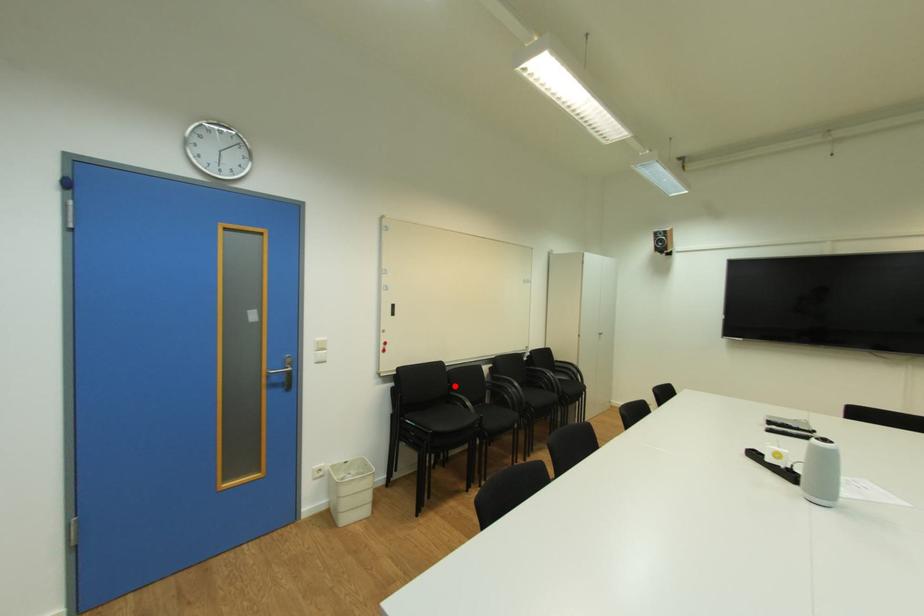
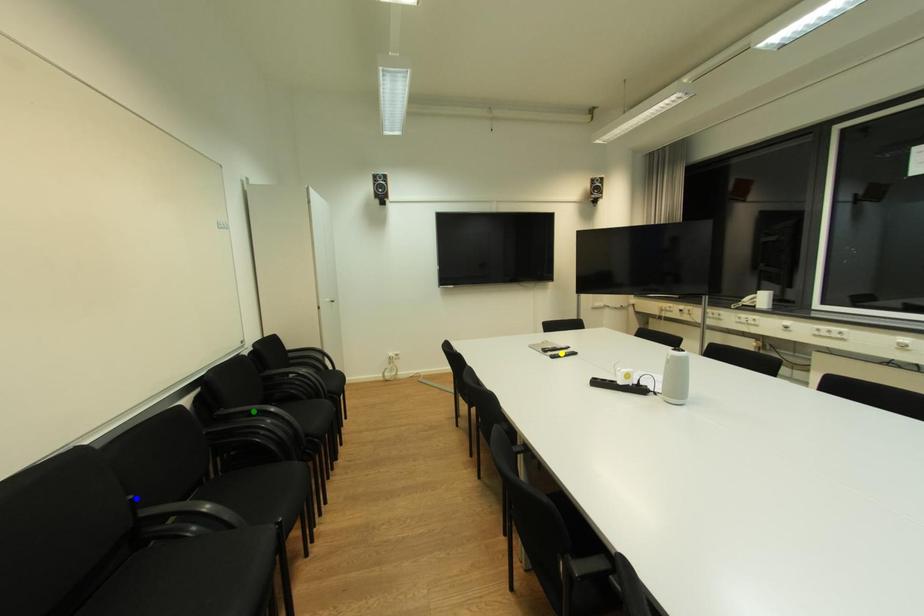
Question: I am providing you with two images of the same scene from different viewpoints. A red point is marked on the first image. You are given multiple points on the second image. Which point in image 2 is actually the same real-world point as the red point in image 1?

Choices:
 (A) green point
 (B) yellow point
 (C) blue point

Answer: (C)